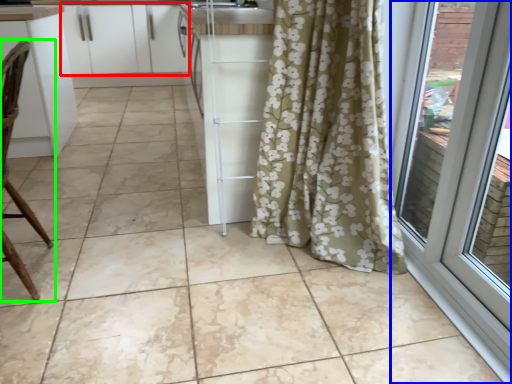
Question: Which object is positioned farthest from cabinetry (highlighted by a red box)? Select from door (highlighted by a blue box) and chair (highlighted by a green box).

Choices:
 (A) door
 (B) chair

Answer: (A)